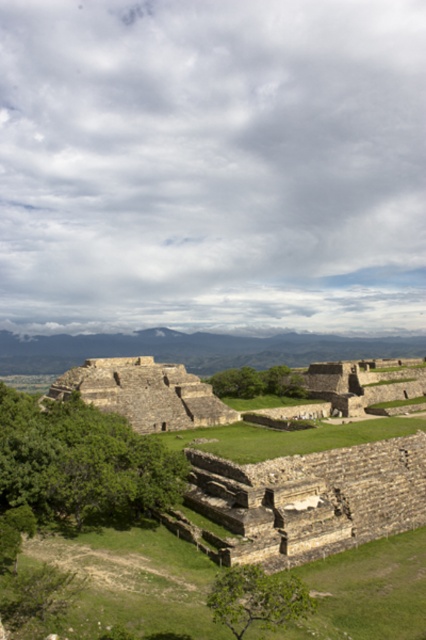
You are standing at the base of the ancient stone structure and want to reach a specific point in the image. If you see both point (92, 376) and point (422, 419), which point is closer to you?

Point (92, 376) is behind point (422, 419), so the closer point to you is point (422, 419).

You are standing in the ancient stone structure and want to take a photo of the stone wall at center. Where should you position yourself to capture it in the frame?

The stone wall at center is located at point (302, 500) in the image, so you should position yourself directly in front of it to capture it in the frame.

From the picture: You are standing on the green grassy at center and want to reach the brown stone pyramid at center. Which direction should you move to get there?

The brown stone pyramid at center is located above the green grassy at center, so you should move upward to reach it.